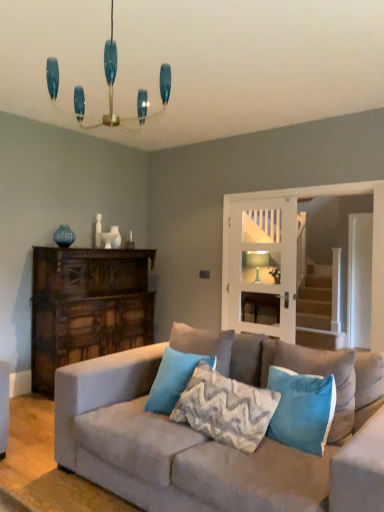
Question: Considering the positions of teal velvet pillow at center, which appears as the 4th pillow when viewed from the right, and suede couch at center in the image, is teal velvet pillow at center, which appears as the 4th pillow when viewed from the right, bigger or smaller than suede couch at center?

Choices:
 (A) big
 (B) small

Answer: (B)

Question: Is point (180, 358) closer or farther from the camera than point (327, 480)?

Choices:
 (A) closer
 (B) farther

Answer: (B)

Question: Which object is the farthest from the translucent glass candlestick at center?

Choices:
 (A) teal glass chandelier at upper center
 (B) teal velvet pillow at center, placed as the fourth pillow when sorted from left to right
 (C) dark brown wood dresser at left
 (D) suede couch at center
 (E) velvet blue pillow at center, the 3th pillow in the right-to-left sequence

Answer: (D)

Question: Based on their relative distances, which object is nearer to the white glass door at center?

Choices:
 (A) dark brown wood dresser at left
 (B) velvet blue pillow at center, arranged as the 2th pillow when viewed from the left
 (C) teal velvet pillow at center, which appears as the 4th pillow when viewed from the right
 (D) teal velvet pillow at center, the 1th pillow positioned from the right
 (E) textured gray pillow at center, marked as the 3th pillow in a left-to-right arrangement

Answer: (A)